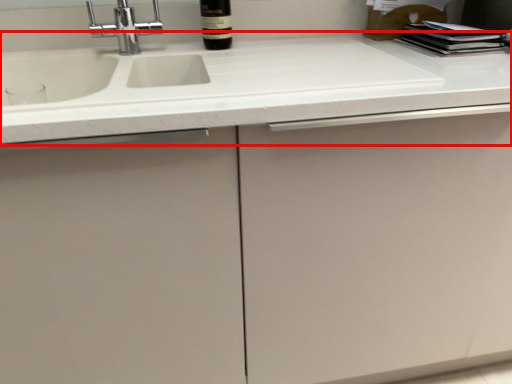
Question: From the image's perspective, where is countertop (annotated by the red box) located relative to bottle?

Choices:
 (A) above
 (B) below

Answer: (B)